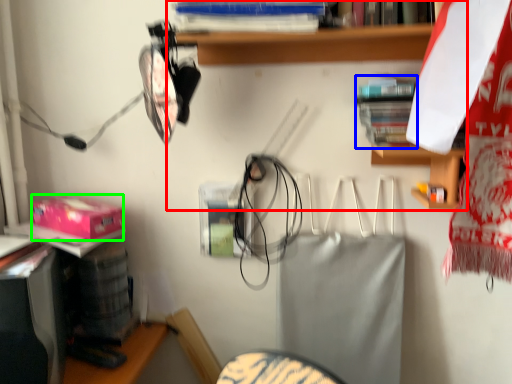
Question: Which object is the farthest from shelf (highlighted by a red box)? Choose among these: book (highlighted by a blue box) or box (highlighted by a green box).

Choices:
 (A) book
 (B) box

Answer: (B)